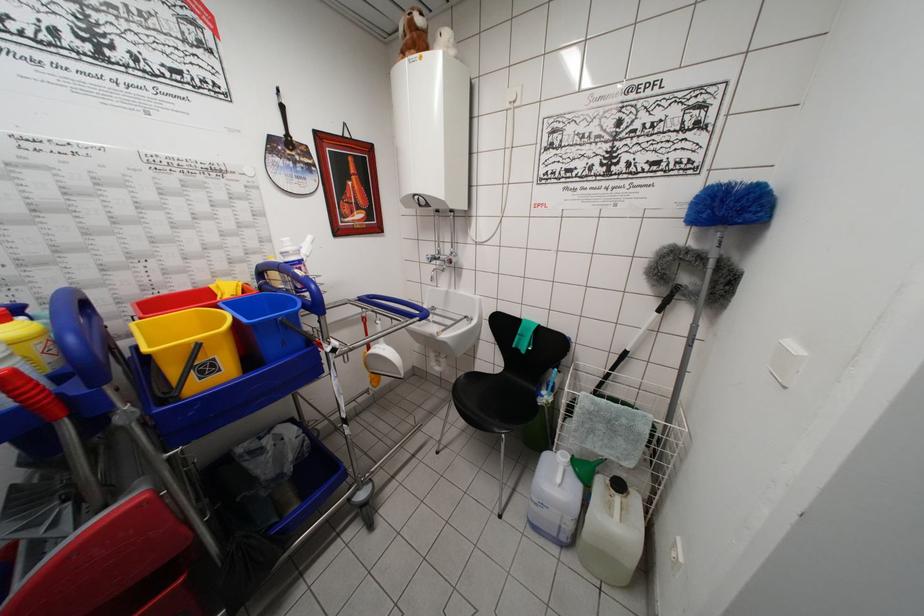
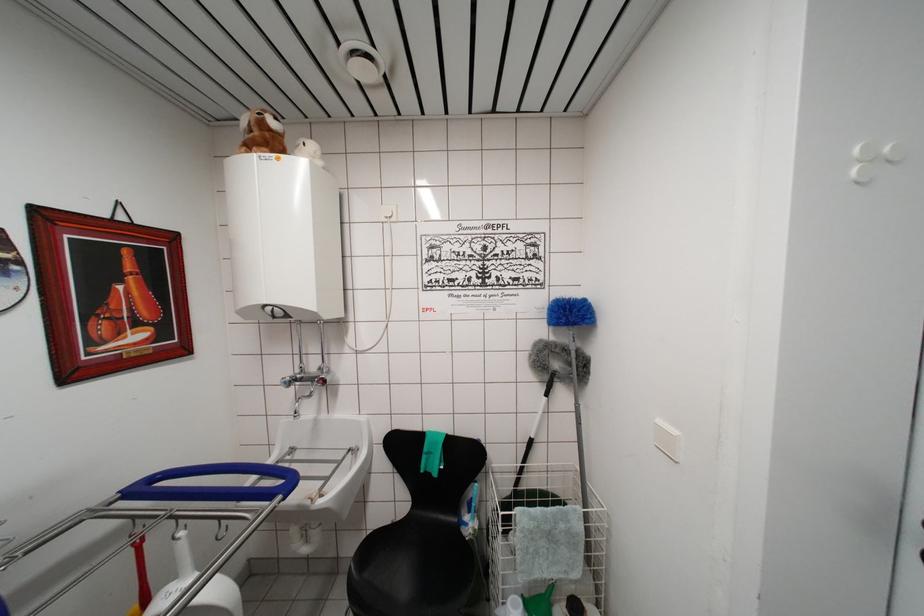
Question: The images are taken continuously from a first-person perspective. In which direction is your viewpoint rotating?

Choices:
 (A) Left
 (B) Right
 (C) Up
 (D) Down

Answer: (B)